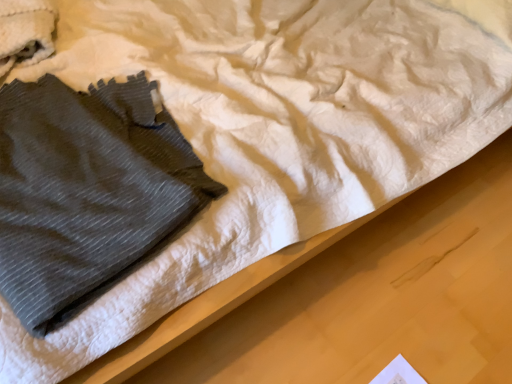
Where is `dark gray corduroy pants at left`? This screenshot has width=512, height=384. dark gray corduroy pants at left is located at coordinates (87, 192).

Describe the element at coordinates (87, 192) in the screenshot. The width and height of the screenshot is (512, 384). I see `dark gray corduroy pants at left` at that location.

Find the location of a particular element. The height and width of the screenshot is (384, 512). dark gray corduroy pants at left is located at coordinates (87, 192).